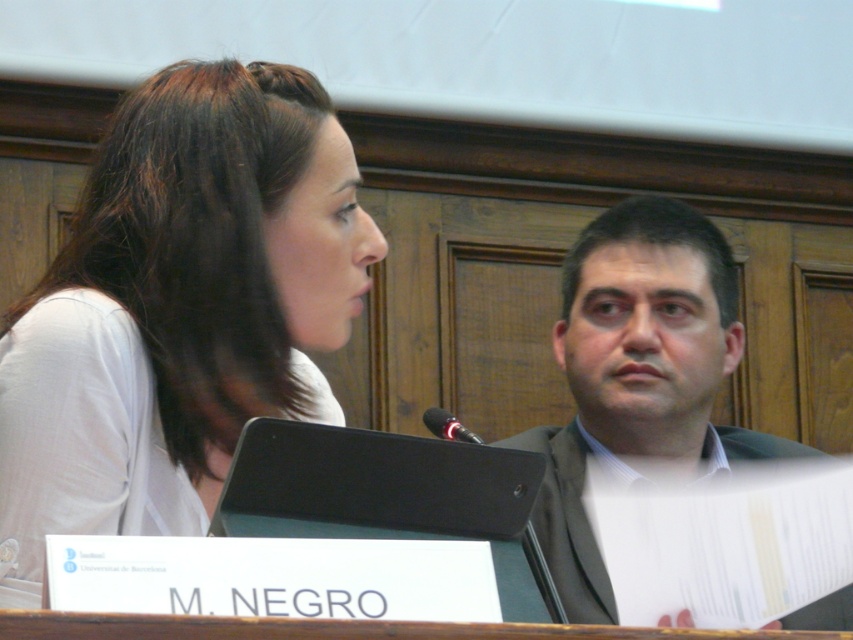
Consider the image. Which of these two, white matte shirt at upper left or dark gray suit at right, stands taller?

dark gray suit at right

Which is behind, point (245, 115) or point (624, 225)?

The point (624, 225) is more distant.

Locate an element on the screen. Image resolution: width=853 pixels, height=640 pixels. white matte shirt at upper left is located at coordinates (178, 308).